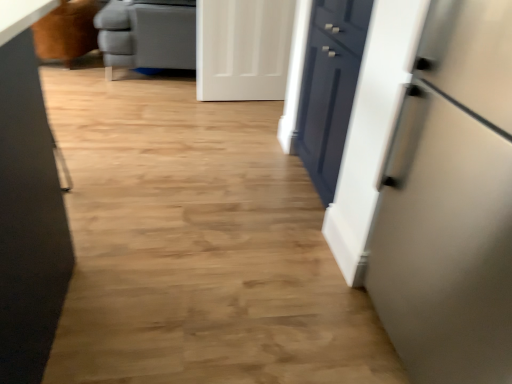
This screenshot has height=384, width=512. What are the coordinates of `vacant region under glossy dark blue drawer at center right (from a real-world perspective)` in the screenshot? It's located at (310, 180).